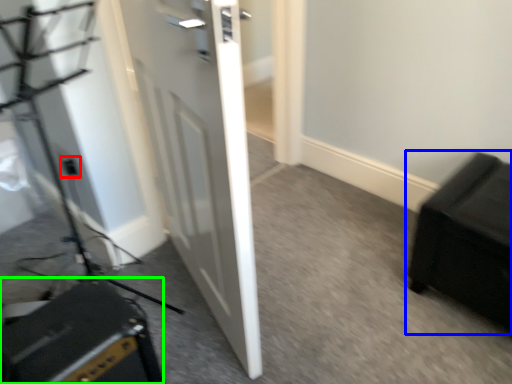
Question: Estimate the real-world distances between objects in this image. Which object is farther from electric outlet (highlighted by a red box), furniture (highlighted by a blue box) or speaker (highlighted by a green box)?

Choices:
 (A) furniture
 (B) speaker

Answer: (A)